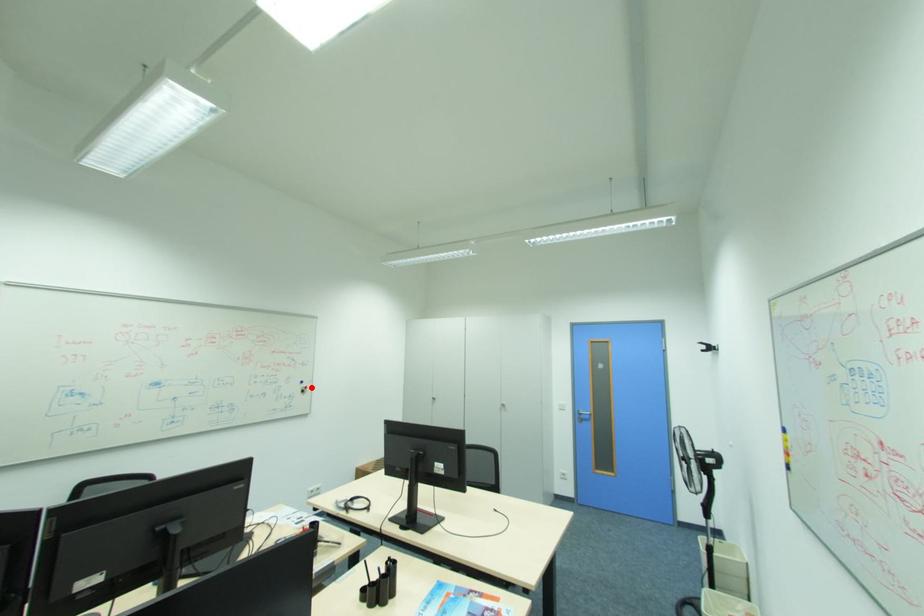
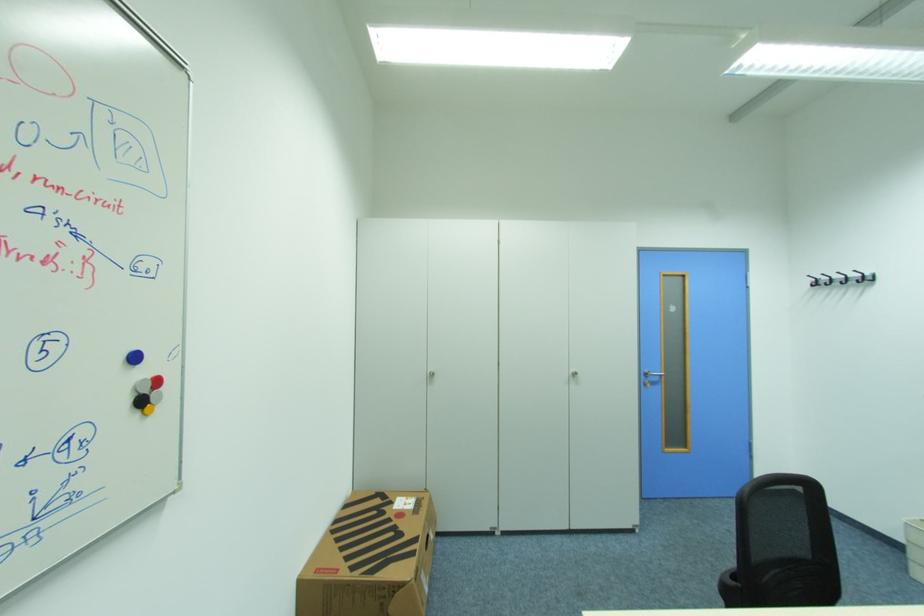
Locate, in the second image, the point that corresponds to the highlighted location in the first image.

(162, 382)